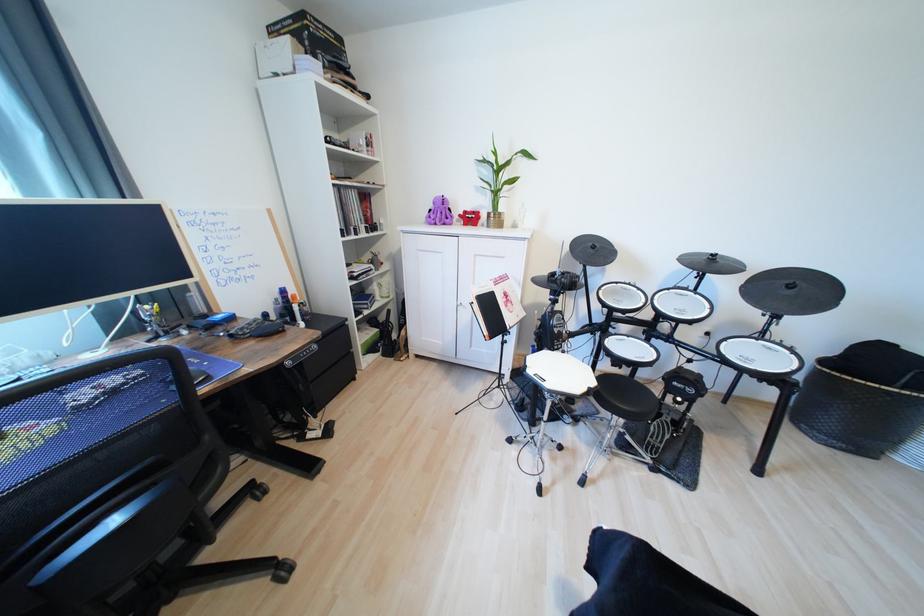
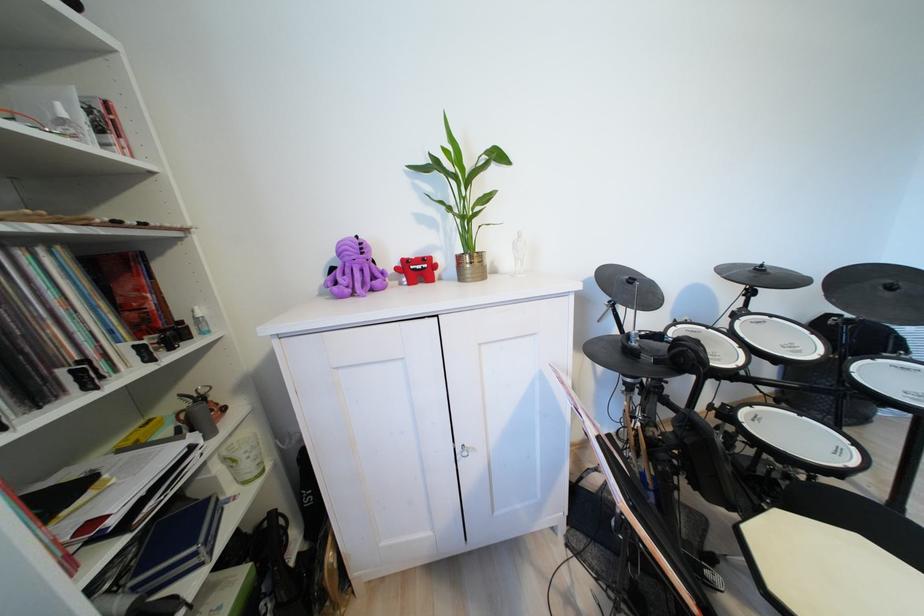
Where in the second image is the point corresponding to pixel 447 216 from the first image?

(360, 274)